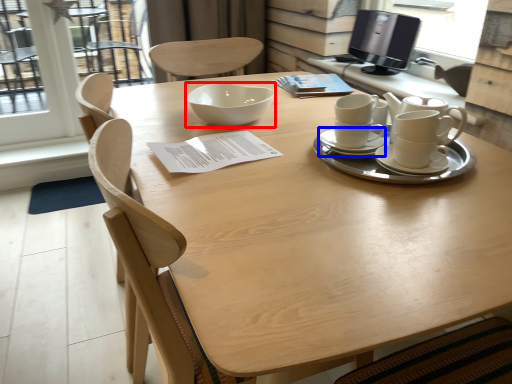
Question: Which of the following is the closest to the observer, bowl (highlighted by a red box) or saucer (highlighted by a blue box)?

Choices:
 (A) bowl
 (B) saucer

Answer: (B)